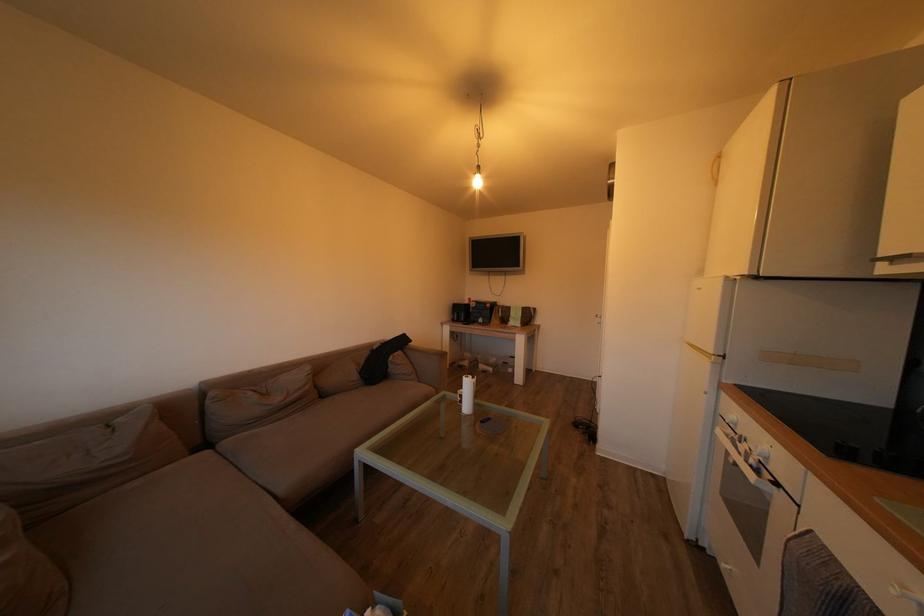
The image size is (924, 616). Describe the element at coordinates (310, 443) in the screenshot. I see `a sofa sitting surface` at that location.